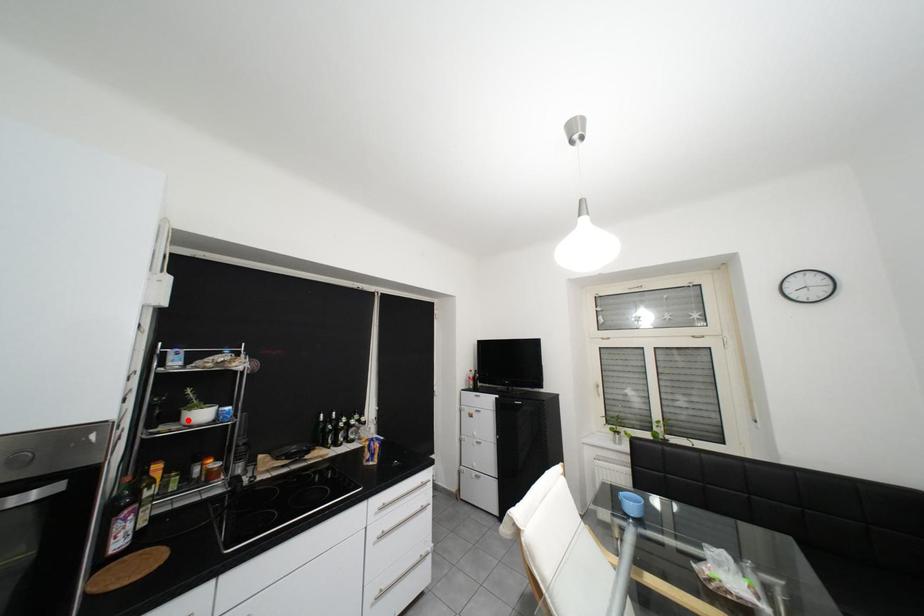
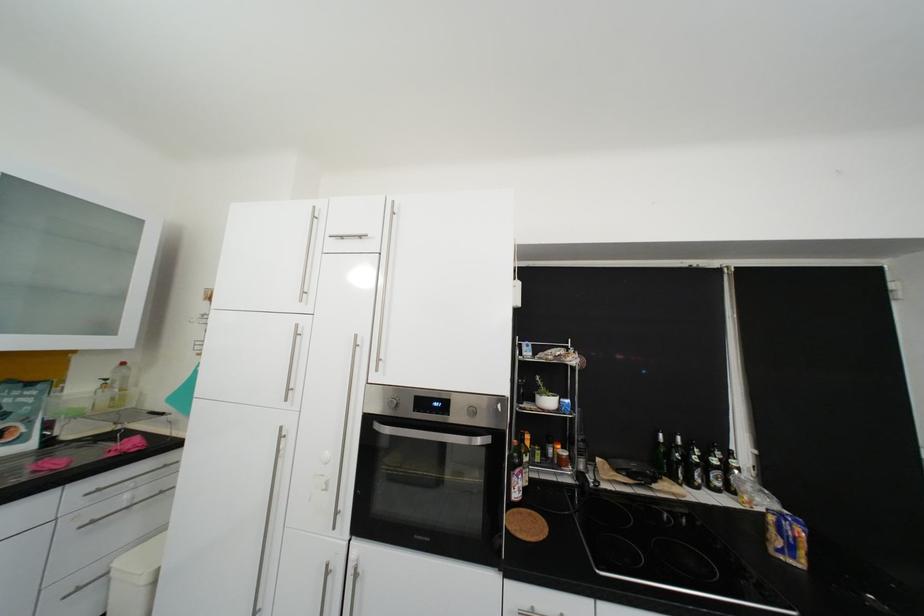
Locate, in the second image, the point that corresponds to the highlighted location in the first image.

(544, 400)